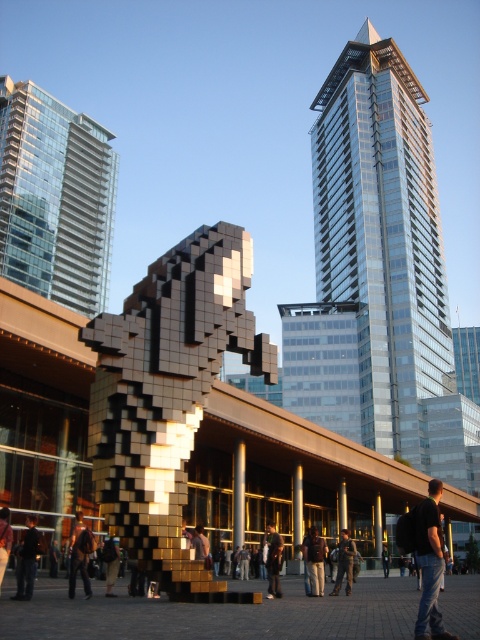
Who is more forward, (x=427, y=605) or (x=265, y=532)?

Point (x=427, y=605) is in front.

Between point (431, 593) and point (271, 586), which one is positioned behind?

Point (271, 586)

Who is more forward, (419, 552) or (280, 557)?

Point (419, 552) is in front.

The width and height of the screenshot is (480, 640). I want to click on black backpack at lower right, so click(430, 563).

Can you confirm if glassy metallic skyscraper at upper right is positioned below black backpack at lower right?

Actually, glassy metallic skyscraper at upper right is above black backpack at lower right.

Where is `glassy metallic skyscraper at upper right`? This screenshot has width=480, height=640. glassy metallic skyscraper at upper right is located at coordinates (383, 237).

Which is behind, point (423, 324) or point (427, 536)?

The point (423, 324) is behind.

Find the location of `glassy metallic skyscraper at upper right`. glassy metallic skyscraper at upper right is located at coordinates (383, 237).

Which is more to the right, glassy reflective skyscraper at upper left or black backpack at lower right?

Positioned to the right is black backpack at lower right.

In the scene shown: Can you confirm if glassy reflective skyscraper at upper left is smaller than black backpack at lower right?

Incorrect, glassy reflective skyscraper at upper left is not smaller in size than black backpack at lower right.

Find the location of a particular element. The height and width of the screenshot is (640, 480). glassy reflective skyscraper at upper left is located at coordinates (55, 196).

Find the location of a particular element. The height and width of the screenshot is (640, 480). glassy reflective skyscraper at upper left is located at coordinates (55, 196).